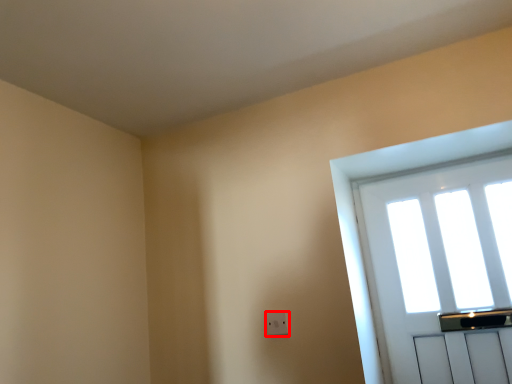
Question: In this image, where is electric outlet (annotated by the red box) located relative to window?

Choices:
 (A) right
 (B) left

Answer: (B)